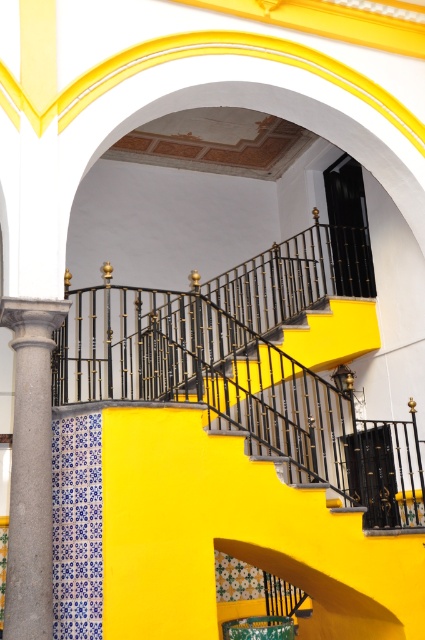
You are an interior designer planning to install a new light fixture. You see the gray stone column at left and the black wrought iron balustrade at center. Which object is positioned lower in the scene?

The gray stone column at left is located below the black wrought iron balustrade at center, so it is positioned lower in the scene.

You are standing at the point labeled point at (17, 461) and want to reach the entrance door located at the opposite side of the staircase. The staircase has a width of 17.85 feet. If you walk straight towards the door, will you have enough space to pass through without touching the staircase railing?

The distance between you and the entrance door is 17.85 feet, which matches the staircase width, so you have enough space to pass through without touching the railing.

You are an architect designing a new building and want to replicate the staircase design shown. The building has a narrow corridor where the staircase will be placed. If the gray stone column at left and black wrought iron balustrade at center must be exactly 3 meters apart to fit the corridor, will the existing design work?

The gray stone column at left and black wrought iron balustrade at center are 3.58 meters apart from each other, which is wider than the required 3 meters. Therefore, the existing design will not fit in the corridor as it exceeds the required distance between them.